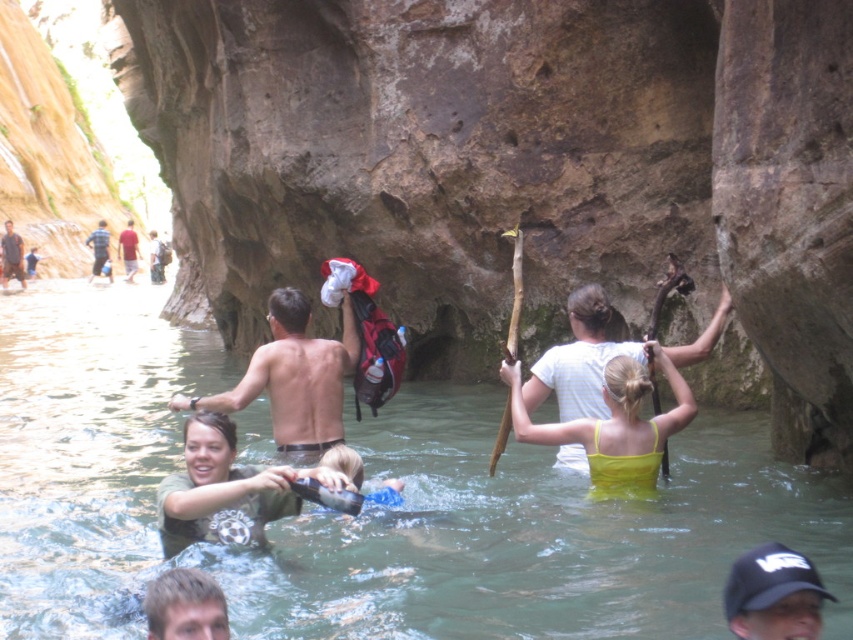
You are a photographer standing at the edge of the waterway. You want to take a photo that includes both the black cap at lower right and the red shirt at center. Given that your camera has a maximum zoom range of 100 meters, will you be able to capture both objects in the same frame without moving closer?

The black cap at lower right is 171.64 meters from the red shirt at center. Since the camera can only zoom up to 100 meters, it cannot capture both objects in the same frame without moving closer.

You are a photographer trying to capture the reflection of the blonde hair at lower left and the red shirt at center in the water. Which object will have a smaller reflection?

The blonde hair at lower left is thinner than the red shirt at center, so its reflection will be smaller.

You are standing at the edge of the waterway and see the shiny metallic backpack at center and the striped shirt at left. Which object is closer to the sunlight coming from the top left corner?

The striped shirt at left is closer to the sunlight coming from the top left corner because it is taller than the shiny metallic backpack at center, which is shorter and positioned lower down.